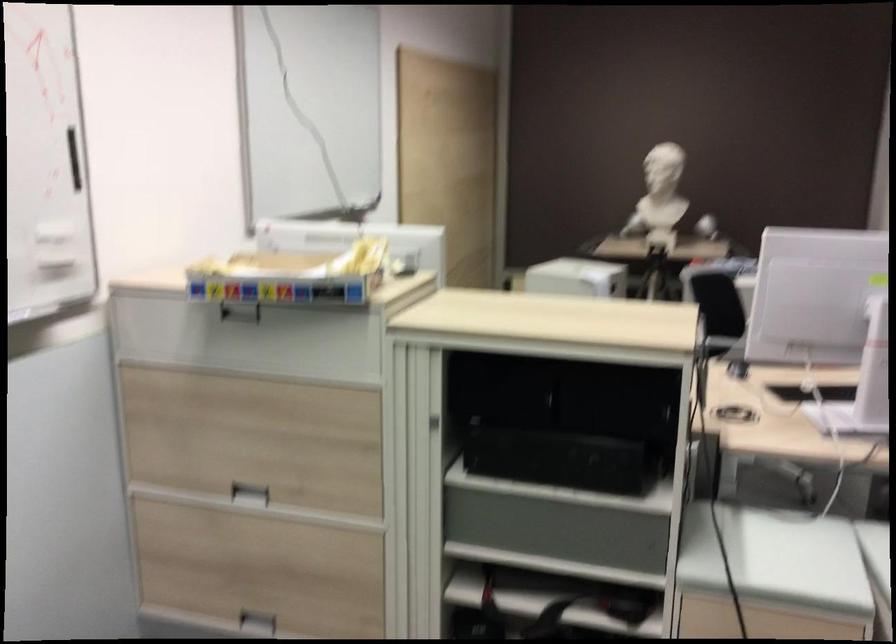
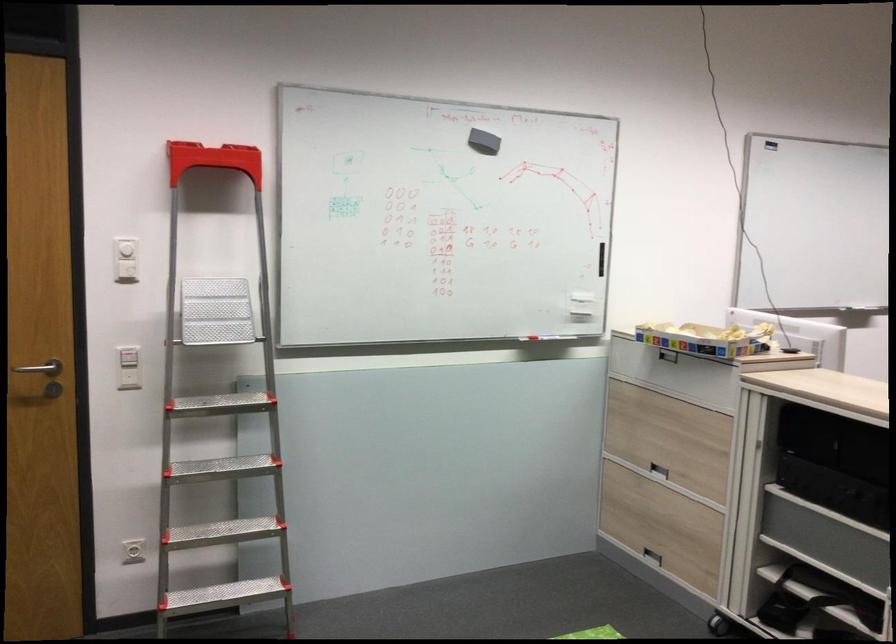
Where in the second image is the point corresponding to pixel 254 491 from the first image?

(658, 469)